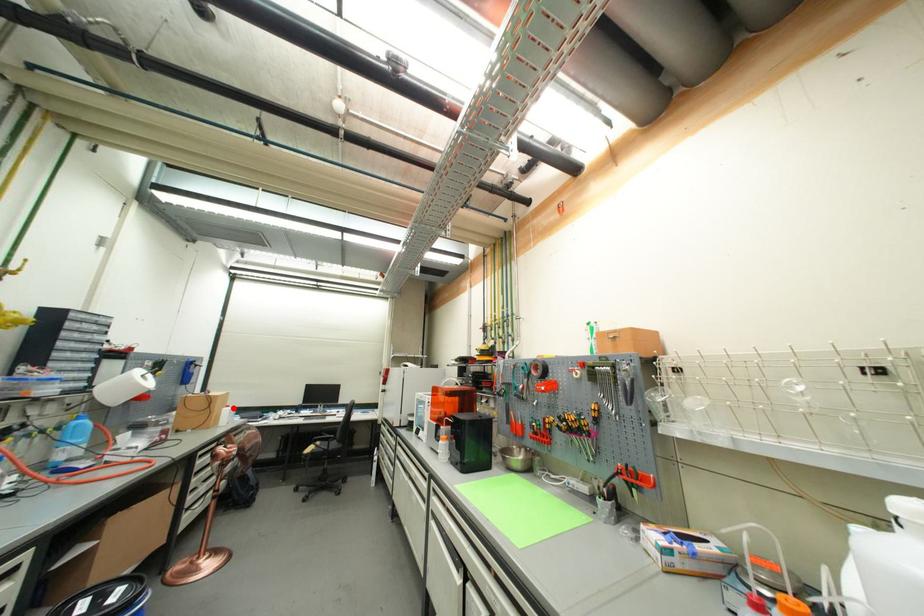
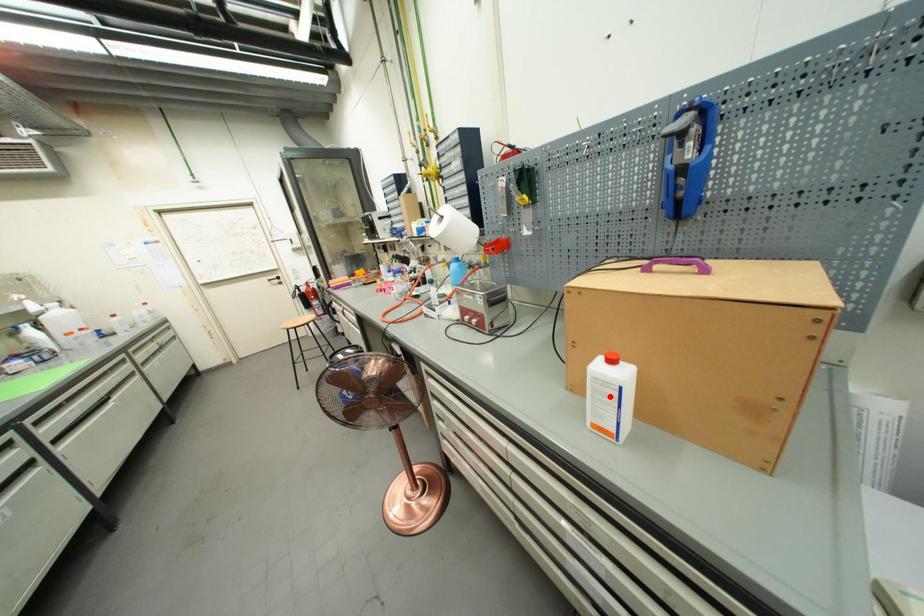
I am providing you with two images of the same scene from different viewpoints. A red point is marked on the first image and another point is marked on the second image. Do the highlighted points in image1 and image2 indicate the same real-world spot?

No